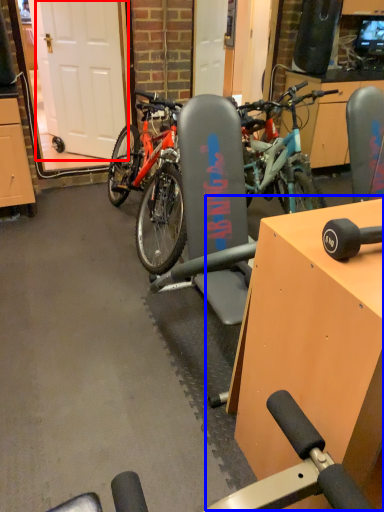
Question: Which object is closer to the camera taking this photo, garage door (highlighted by a red box) or table (highlighted by a blue box)?

Choices:
 (A) garage door
 (B) table

Answer: (B)